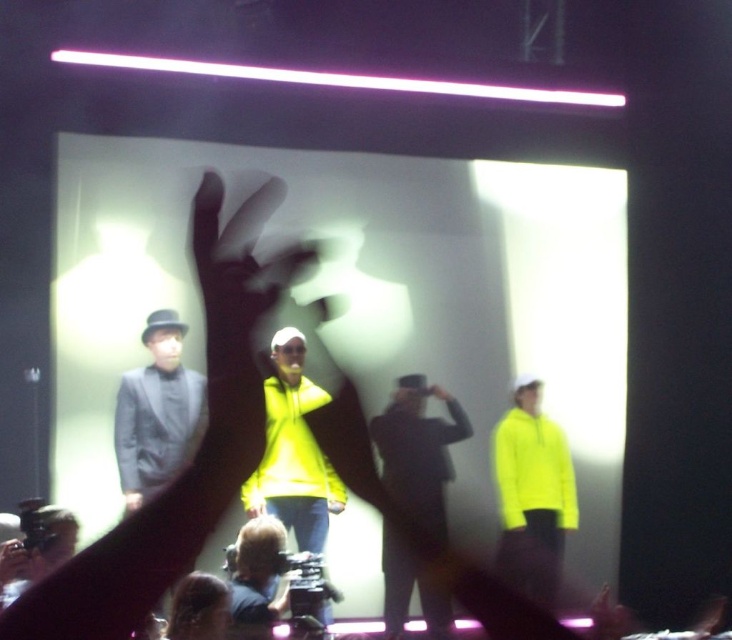
Is point (433, 426) positioned in front of point (294, 330)?

That is False.

Is point (392, 481) closer to camera compared to point (272, 371)?

That is False.

Where is `dark gray suit at center`? This screenshot has width=732, height=640. dark gray suit at center is located at coordinates (418, 449).

Can you confirm if neon yellow hoodie at right is positioned above neon yellow hoodie at center?

Incorrect, neon yellow hoodie at right is not positioned above neon yellow hoodie at center.

Between neon yellow hoodie at right and neon yellow hoodie at center, which one is positioned lower?

neon yellow hoodie at right

The width and height of the screenshot is (732, 640). What are the coordinates of `neon yellow hoodie at right` in the screenshot? It's located at (531, 492).

What do you see at coordinates (418, 449) in the screenshot? Image resolution: width=732 pixels, height=640 pixels. I see `dark gray suit at center` at bounding box center [418, 449].

Find the location of a particular element. This screenshot has height=640, width=732. dark gray suit at center is located at coordinates (418, 449).